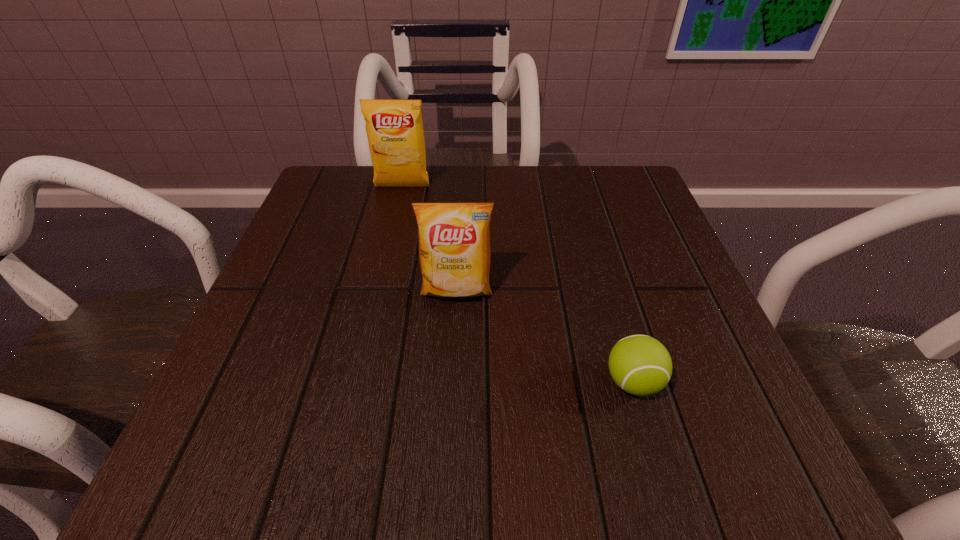
The image size is (960, 540). What are the coordinates of `free space between the shorter crisp (potato chip) and the shortest object` in the screenshot? It's located at (544, 336).

Where is `free space that is in between the left crisp (potato chip) and the tennis ball`? The image size is (960, 540). free space that is in between the left crisp (potato chip) and the tennis ball is located at coordinates (517, 285).

I want to click on free space that is in between the second farthest object and the nearest object, so click(544, 336).

Where is `empty space that is in between the rightmost object and the right crisp (potato chip)`? The width and height of the screenshot is (960, 540). empty space that is in between the rightmost object and the right crisp (potato chip) is located at coordinates (544, 336).

The width and height of the screenshot is (960, 540). In order to click on empty space between the shortest object and the second shortest object in this screenshot , I will do `click(544, 336)`.

Where is `free space between the tallest object and the nearest object`? free space between the tallest object and the nearest object is located at coordinates (517, 285).

You are a GUI agent. You are given a task and a screenshot of the screen. Output one action in this format:
    pyautogui.click(x=<x>, y=<y>)
    Task: Click on the vacant space that's between the right crisp (potato chip) and the rightmost object
    
    Given the screenshot: What is the action you would take?
    pyautogui.click(x=544, y=336)

The image size is (960, 540). What are the coordinates of `the closest object relative to the shorter crisp (potato chip)` in the screenshot? It's located at (640, 365).

You are a GUI agent. You are given a task and a screenshot of the screen. Output one action in this format:
    pyautogui.click(x=<x>, y=<y>)
    Task: Click on the object that is the closest to the nearer crisp (potato chip)
    
    Given the screenshot: What is the action you would take?
    pyautogui.click(x=640, y=365)

This screenshot has height=540, width=960. In order to click on vacant region that satisfies the following two spatial constraints: 1. on the front of the tallest object with the logo; 2. on the left side of the nearest object in this screenshot , I will do `click(357, 382)`.